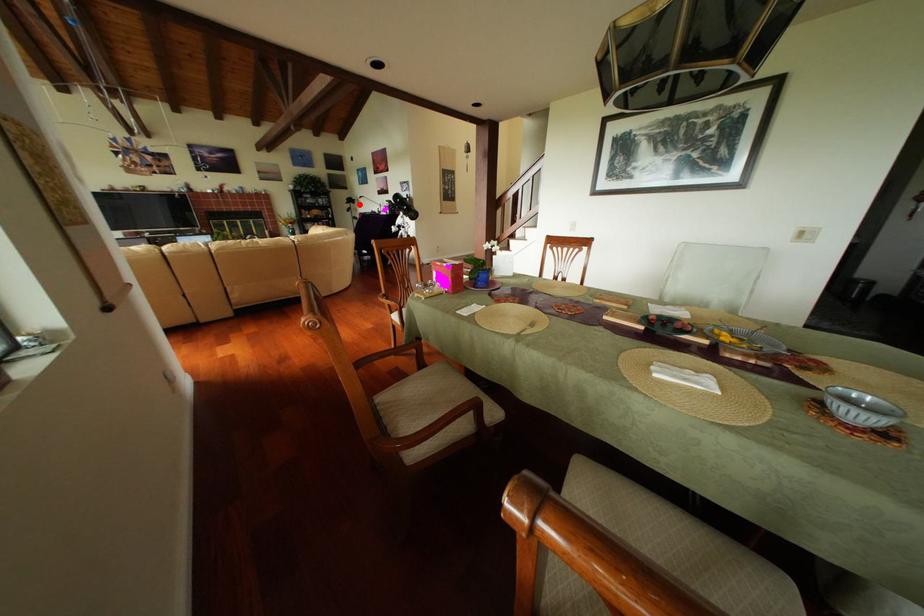
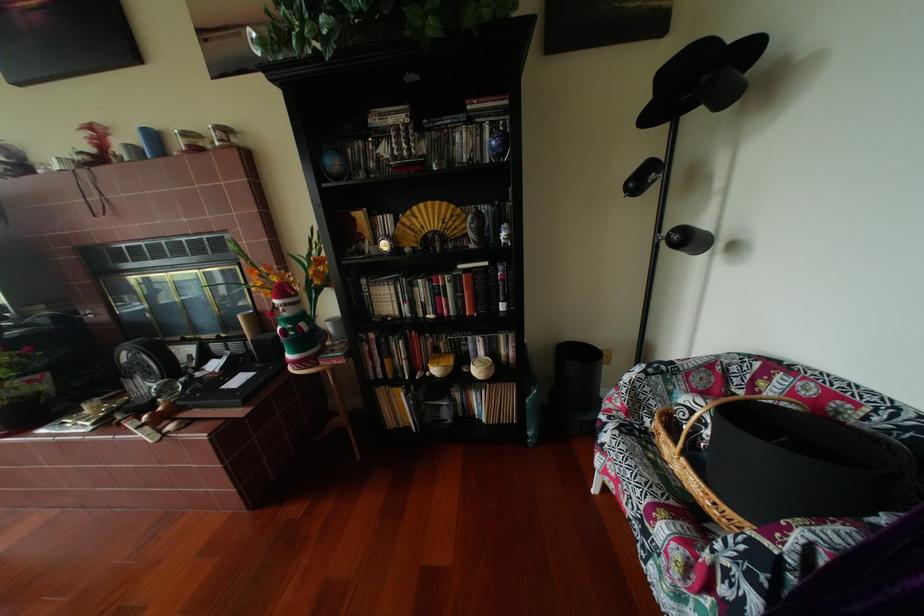
In the second image, find the point that corresponds to the highlighted location in the first image.

(659, 121)